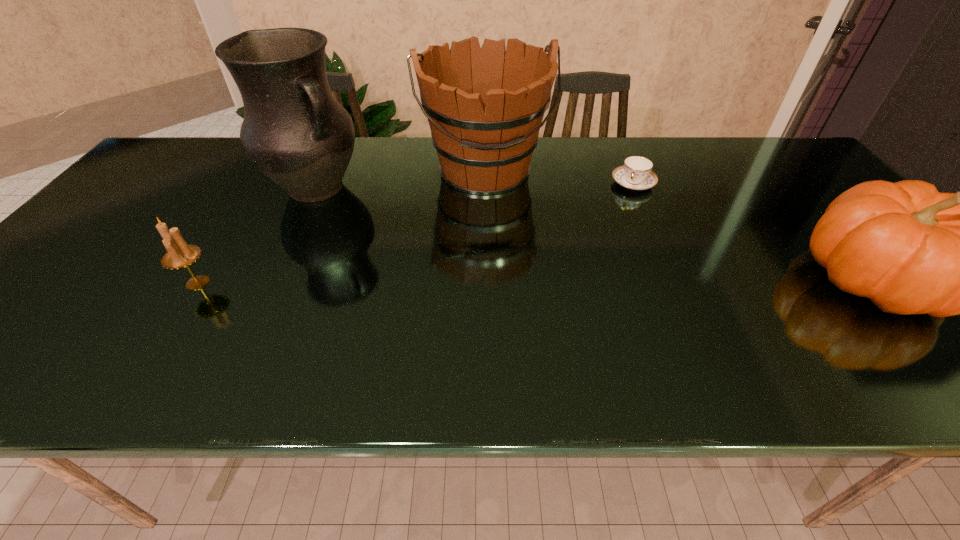
At what (x,y) coordinates should I click in order to perform the action: click on free spot on the desktop that is between the candle holder and the third shortest object and is positioned on the side with the handle of the teacup. Please return your answer as a coordinate pair (x, y). The width and height of the screenshot is (960, 540). Looking at the image, I should click on (580, 280).

You are a GUI agent. You are given a task and a screenshot of the screen. Output one action in this format:
    pyautogui.click(x=<x>, y=<y>)
    Task: Click on the vacant spot on the desktop that is between the second shortest object and the pumpkin and is positioned with the handle on the wine bucket
    Image resolution: width=960 pixels, height=540 pixels.
    Given the screenshot: What is the action you would take?
    pyautogui.click(x=520, y=280)

Locate an element on the screen. The width and height of the screenshot is (960, 540). free space on the desktop that is between the fourth tallest object and the third tallest object and is positioned on the handle side of the pitcher is located at coordinates (444, 281).